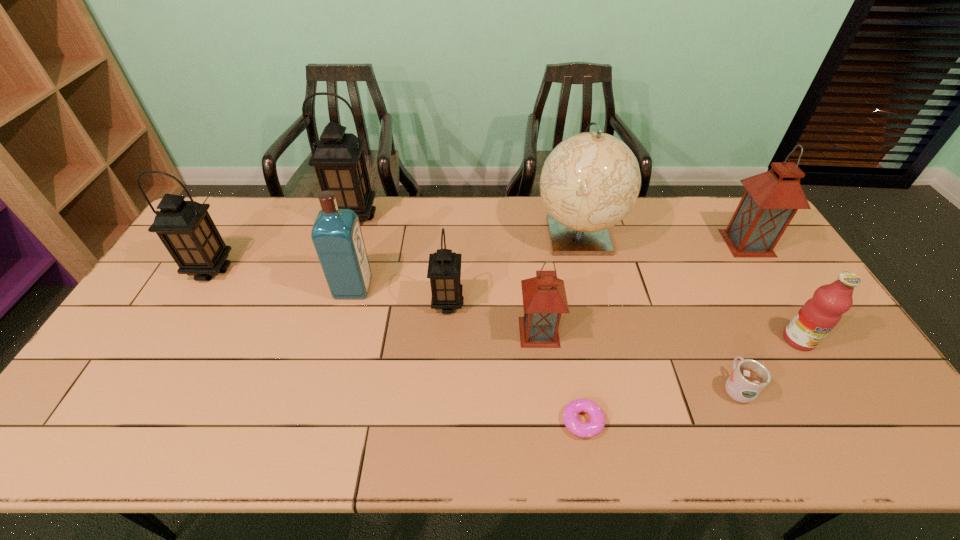
Where is `the tallest lantern`? This screenshot has height=540, width=960. the tallest lantern is located at coordinates (338, 158).

Image resolution: width=960 pixels, height=540 pixels. Find the location of `the second black lantern from left to right`. the second black lantern from left to right is located at coordinates (338, 158).

At what (x,y) coordinates should I click in order to perform the action: click on beige globe. Please return your answer as a coordinate pair (x, y). Image resolution: width=960 pixels, height=540 pixels. Looking at the image, I should click on (590, 181).

Find the location of a particular element. This screenshot has height=540, width=960. the bigger pink lantern is located at coordinates (772, 198).

In order to click on the farther pink lantern in this screenshot , I will do `click(772, 198)`.

Identify the location of the leftmost black lantern. This screenshot has width=960, height=540. (186, 229).

Identify the location of the second nearest black lantern. The height and width of the screenshot is (540, 960). (186, 229).

This screenshot has width=960, height=540. I want to click on liquor, so click(x=336, y=233).

Identify the location of the rightmost black lantern. This screenshot has width=960, height=540. (444, 268).

This screenshot has height=540, width=960. Identify the location of the smallest black lantern. (444, 268).